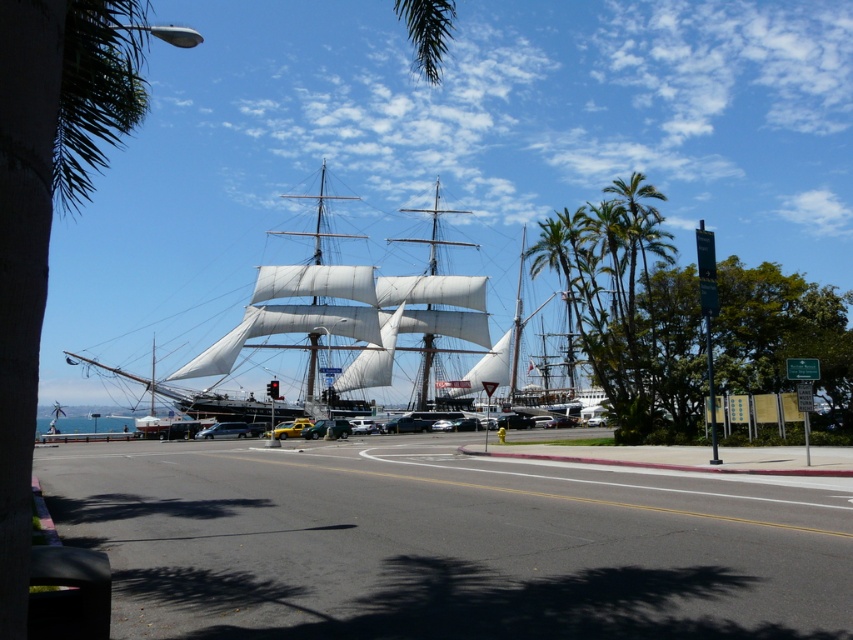
You are a photographer planning to capture the white canvas sailboat at center and the wooden mast at center in a single frame. Given their relative sizes, which object will occupy more space in your photo?

The white canvas sailboat at center will occupy more space in the photo because its width surpasses that of the wooden mast at center.

You are a photographer planning to capture the white canvas sailboat at center and the wooden mast at center in a single shot. Given their sizes, which object should you focus on first to ensure both are clearly visible in your photo?

The white canvas sailboat at center is larger than the wooden mast at center, so focusing on the sailboat first will help ensure both objects are clearly visible in the photo.